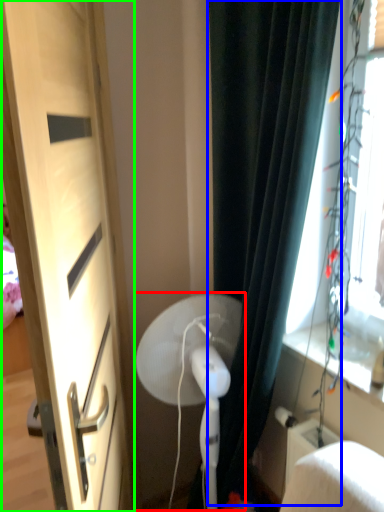
Question: Considering the real-world distances, which object is closest to fan (highlighted by a red box)? curtain (highlighted by a blue box) or door (highlighted by a green box).

Choices:
 (A) curtain
 (B) door

Answer: (A)